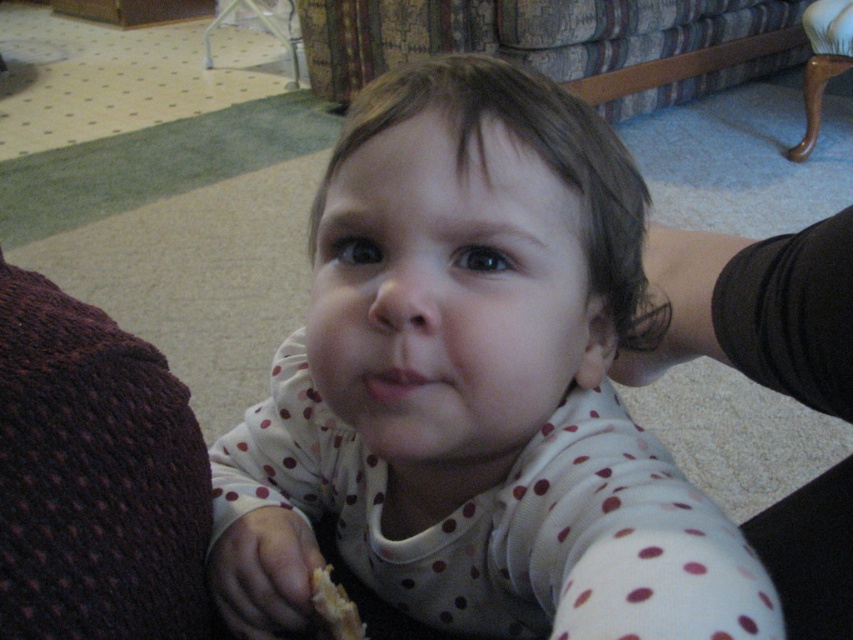
You are a parent trying to dress your child. You have a white polka dot onesie at center and a dark purple knitted sweater at left. Which clothing item is bigger?

Result: The white polka dot onesie at center is larger in size compared to the dark purple knitted sweater at left.

You are a parent trying to reach your child who is sitting at point (x=490, y=296) in the image. Your hand can extend 12 inches. Can you reach them?

The distance between you and the child at point (x=490, y=296) is 13.22 inches, which is greater than your hand extension of 12 inches. Therefore, you cannot reach them.

You are a photographer setting up a shot of the child wearing the white polka dot onesie at center and holding the crumbly bread at lower left. To ensure both are in focus, you need to know their relative sizes. Which object is significantly larger?

The white polka dot onesie at center is much taller than the crumbly bread at lower left, so the onesie is significantly larger.